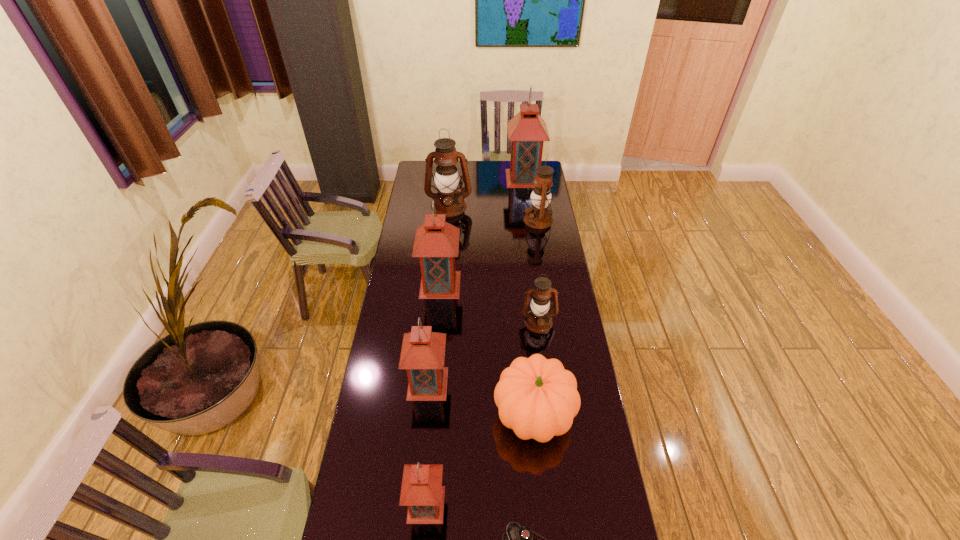
Identify the location of the eighth farthest object. (422, 492).

In order to click on the smallest pink lantern in this screenshot , I will do `click(422, 492)`.

This screenshot has height=540, width=960. I want to click on pumpkin, so pyautogui.click(x=536, y=397).

Find the location of a particular element. The width and height of the screenshot is (960, 540). free space located 0.320m on the left of the tallest object is located at coordinates (452, 178).

You are a GUI agent. You are given a task and a screenshot of the screen. Output one action in this format:
    pyautogui.click(x=<x>, y=<y>)
    Task: Click on the vacant space located on the side of the biggest brown lantern, there is a wick adjustment knob
    
    Given the screenshot: What is the action you would take?
    pyautogui.click(x=444, y=264)

This screenshot has height=540, width=960. What are the coordinates of `blank area located 0.340m on the front of the fourth farthest object` in the screenshot? It's located at tap(433, 364).

In order to click on vacant area located 0.360m on the front of the second smallest pink lantern in this screenshot , I will do `click(416, 510)`.

This screenshot has height=540, width=960. What are the coordinates of `vacant space located 0.060m on the side of the second biggest brown lantern, there is a wick adjustment knob` in the screenshot? It's located at (513, 220).

What are the coordinates of `vacant space situated on the side of the second biggest brown lantern, there is a wick adjustment knob` in the screenshot? It's located at (503, 220).

Image resolution: width=960 pixels, height=540 pixels. What are the coordinates of `vacant area located on the side of the second biggest brown lantern, there is a wick adjustment knob` in the screenshot? It's located at (467, 220).